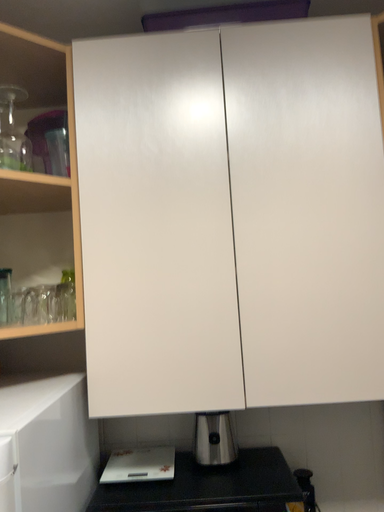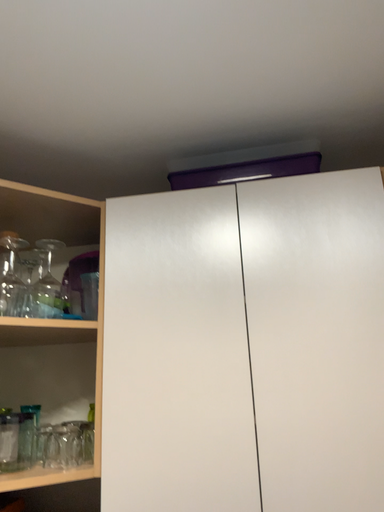
Question: How did the camera likely rotate when shooting the video?

Choices:
 (A) rotated left
 (B) rotated right

Answer: (A)